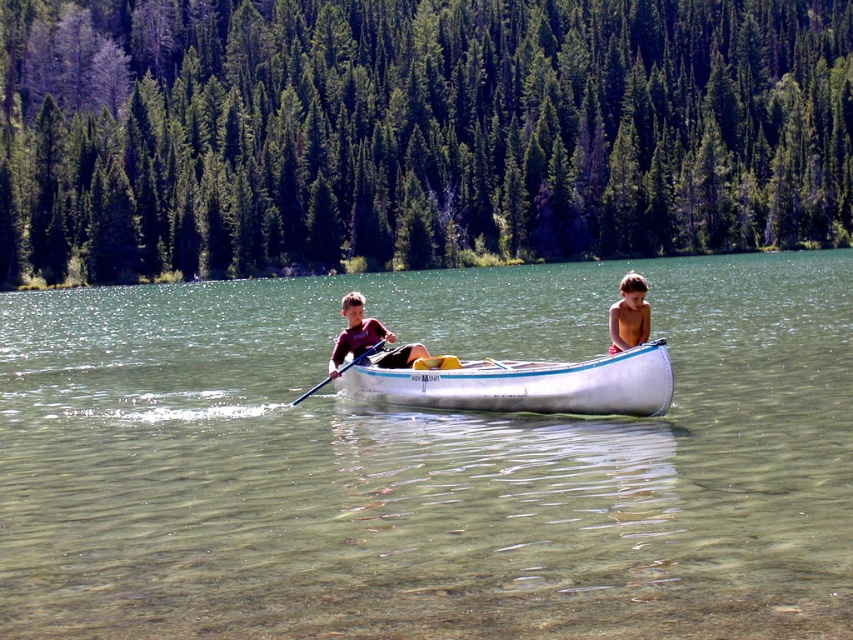
Question: Which object is the farthest from the clear water at center?

Choices:
 (A) wooden polished paddle at center
 (B) smooth skin boy at center

Answer: (A)

Question: Based on their relative distances, which object is nearer to the wooden polished paddle at center?

Choices:
 (A) clear water at center
 (B) white polished wood canoe at center

Answer: (B)

Question: Is dark red fabric shirt at center positioned before smooth skin boy at center?

Choices:
 (A) yes
 (B) no

Answer: (B)

Question: Considering the real-world distances, which object is closest to the dark red fabric shirt at center?

Choices:
 (A) smooth skin boy at center
 (B) white polished wood canoe at center
 (C) clear water at center

Answer: (A)

Question: Is clear water at center wider than white polished wood canoe at center?

Choices:
 (A) yes
 (B) no

Answer: (A)

Question: Can you confirm if clear water at center is positioned to the right of wooden polished paddle at center?

Choices:
 (A) no
 (B) yes

Answer: (B)